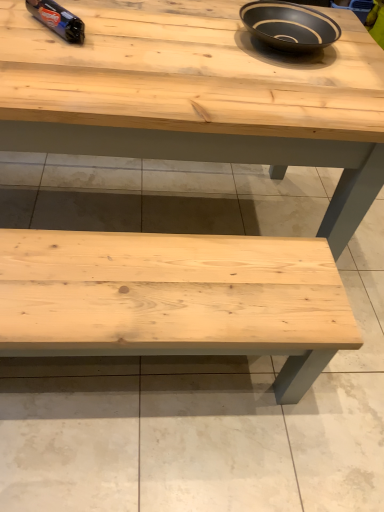
Question: Considering the relative sizes of shiny blue plastic bottle at upper left and natural wood bench at bottom in the image provided, is shiny blue plastic bottle at upper left taller than natural wood bench at bottom?

Choices:
 (A) no
 (B) yes

Answer: (B)

Question: Can you confirm if shiny blue plastic bottle at upper left is thinner than natural wood bench at bottom?

Choices:
 (A) yes
 (B) no

Answer: (A)

Question: Is shiny blue plastic bottle at upper left outside of natural wood bench at bottom?

Choices:
 (A) no
 (B) yes

Answer: (B)

Question: Is shiny blue plastic bottle at upper left bigger than natural wood bench at bottom?

Choices:
 (A) yes
 (B) no

Answer: (B)

Question: Can you confirm if shiny blue plastic bottle at upper left is wider than natural wood bench at bottom?

Choices:
 (A) no
 (B) yes

Answer: (A)

Question: Is natural wood table at center spatially inside black matte bowl at upper center, or outside of it?

Choices:
 (A) outside
 (B) inside

Answer: (A)

Question: From a real-world perspective, is natural wood table at center above or below black matte bowl at upper center?

Choices:
 (A) below
 (B) above

Answer: (A)

Question: In the image, is natural wood table at center positioned in front of or behind black matte bowl at upper center?

Choices:
 (A) front
 (B) behind

Answer: (A)

Question: Is point (132, 40) positioned closer to the camera than point (331, 26)?

Choices:
 (A) closer
 (B) farther

Answer: (A)

Question: Is black matte bowl at upper center bigger or smaller than shiny blue plastic bottle at upper left?

Choices:
 (A) small
 (B) big

Answer: (B)

Question: Is black matte bowl at upper center wider or thinner than shiny blue plastic bottle at upper left?

Choices:
 (A) wide
 (B) thin

Answer: (A)

Question: Would you say black matte bowl at upper center is to the left or to the right of shiny blue plastic bottle at upper left in the picture?

Choices:
 (A) left
 (B) right

Answer: (B)

Question: Is black matte bowl at upper center spatially inside shiny blue plastic bottle at upper left, or outside of it?

Choices:
 (A) outside
 (B) inside

Answer: (A)

Question: Does point coord(57,7) appear closer or farther from the camera than point coord(233,69)?

Choices:
 (A) farther
 (B) closer

Answer: (A)

Question: Relative to natural wood table at center, is shiny blue plastic bottle at upper left in front or behind?

Choices:
 (A) behind
 (B) front

Answer: (A)